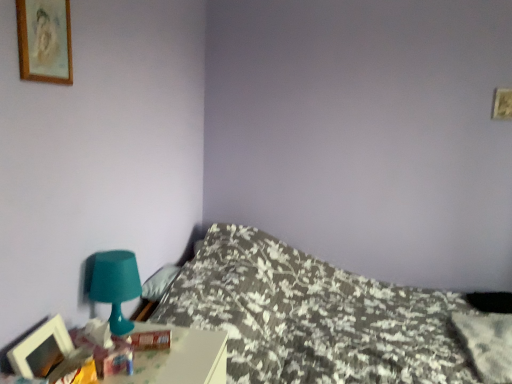
Question: From their relative heights in the image, would you say fluffy white pillow at upper left, the second pillow in the right-to-left sequence, is taller or shorter than teal plastic table lamp at lower left?

Choices:
 (A) short
 (B) tall

Answer: (A)

Question: In the image, is fluffy white pillow at upper left, marked as the first pillow in a left-to-right arrangement, positioned in front of or behind teal plastic table lamp at lower left?

Choices:
 (A) behind
 (B) front

Answer: (A)

Question: Estimate the real-world distances between objects in this image. Which object is closer to the wooden-framed painting at upper left, the 2th picture frame in the bottom-to-top sequence?

Choices:
 (A) fluffy white pillow at upper left, positioned as the 1th pillow in top-to-bottom order
 (B) wooden picture frame at lower left, arranged as the 2th picture frame when viewed from the top
 (C) teal plastic table lamp at lower left
 (D) floral-patterned fabric bed at lower left
 (E) fluffy white pillow at center, which appears as the first pillow when viewed from the right

Answer: (C)

Question: Estimate the real-world distances between objects in this image. Which object is farther from the wooden picture frame at lower left, arranged as the 2th picture frame when viewed from the top?

Choices:
 (A) fluffy white pillow at upper left, the second pillow in the right-to-left sequence
 (B) teal plastic lamp at lower left
 (C) teal plastic table lamp at lower left
 (D) fluffy white pillow at center, which appears as the first pillow when viewed from the right
 (E) floral-patterned fabric bed at lower left

Answer: (D)